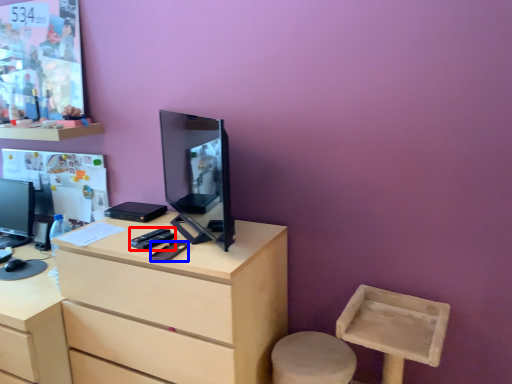
Question: Which object is closer to the camera taking this photo, remote control (highlighted by a red box) or mobile phone (highlighted by a blue box)?

Choices:
 (A) remote control
 (B) mobile phone

Answer: (B)